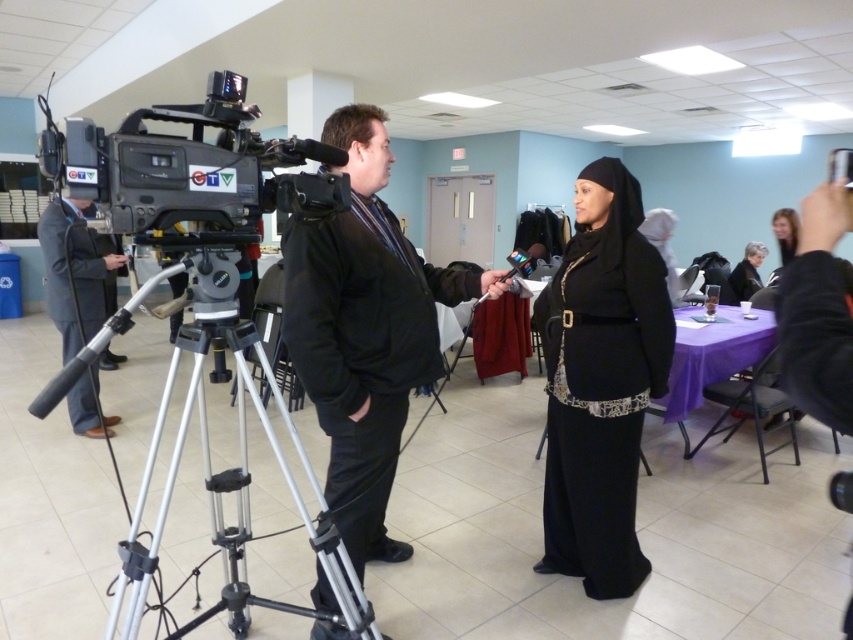
You are a stagehand setting up for an event. You need to position a new light above the black velvet robe at center without affecting the matte black microphone at left. Based on the current setup, is this possible?

The matte black microphone at left is below the black velvet robe at center, so positioning a light above the black velvet robe at center would not interfere with the matte black microphone at left since it is already positioned lower.

You are a photographer standing in the conference room. You need to position a wide shot that includes both the black matte dress at center and the silver metallic tripod at center. Which object will require more horizontal space in the frame?

The silver metallic tripod at center requires more horizontal space in the frame because its width is greater than the black matte dress at center.